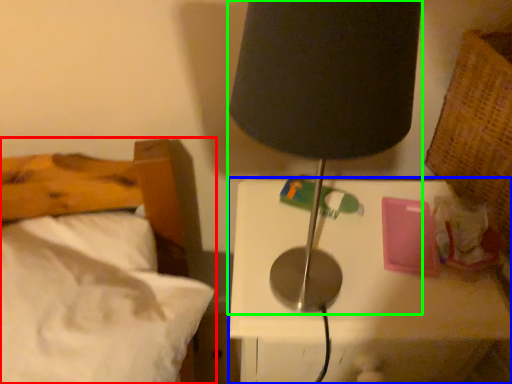
Question: Based on their relative distances, which object is farther from bed (highlighted by a red box)? Choose from nightstand (highlighted by a blue box) and lamp (highlighted by a green box).

Choices:
 (A) nightstand
 (B) lamp

Answer: (B)